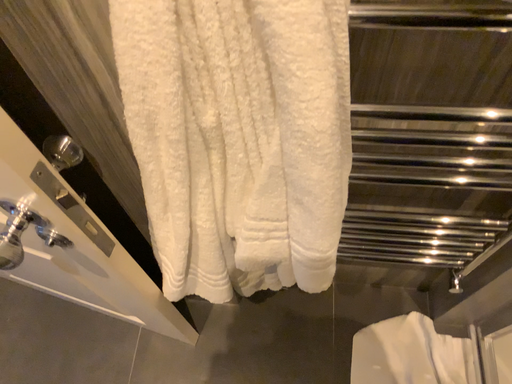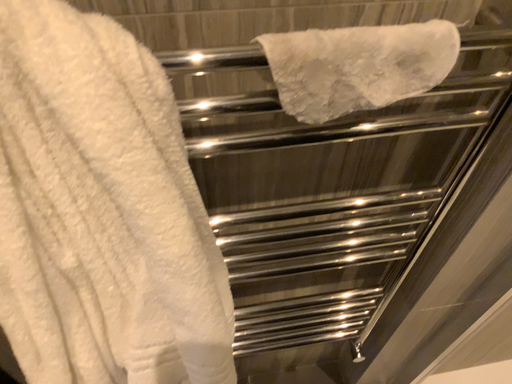
Question: How did the camera likely rotate when shooting the video?

Choices:
 (A) rotated downward
 (B) rotated upward

Answer: (B)